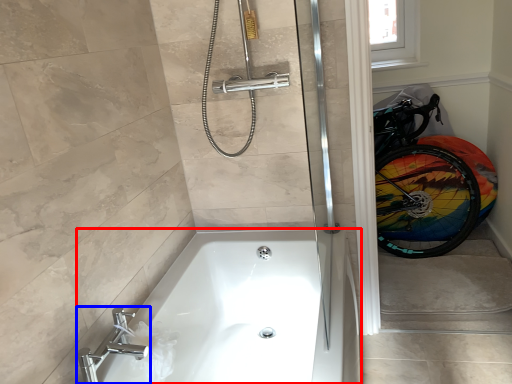
Question: Which of the following is the closest to the observer, bathtub (highlighted by a red box) or tap (highlighted by a blue box)?

Choices:
 (A) bathtub
 (B) tap

Answer: (A)